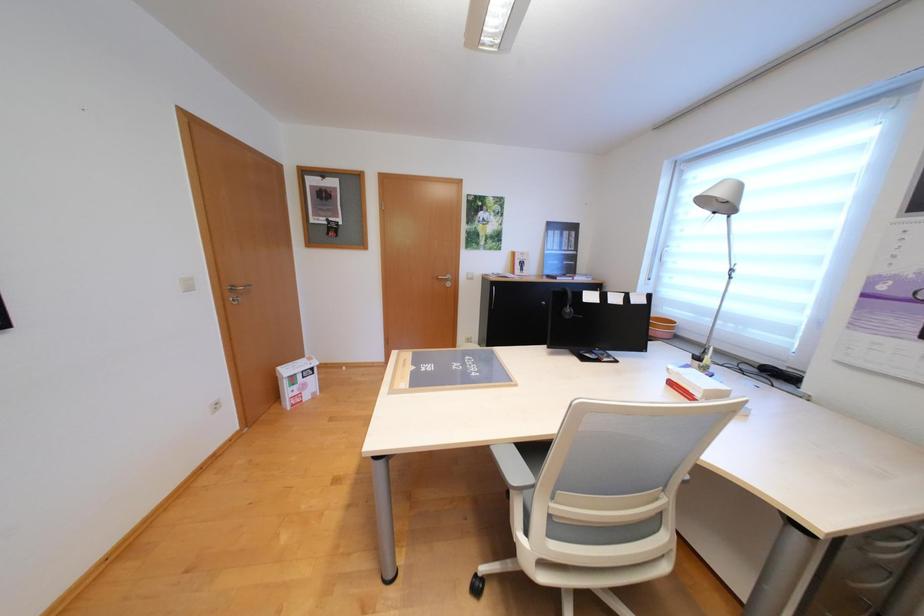
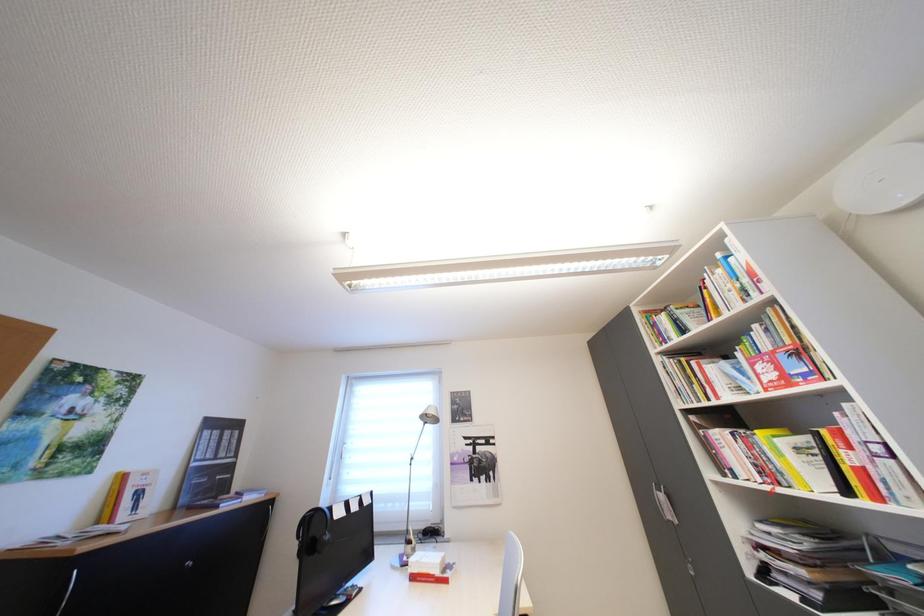
The first image is from the beginning of the video and the second image is from the end. How did the camera likely rotate when shooting the video?

The rotation direction of the camera is right-up.